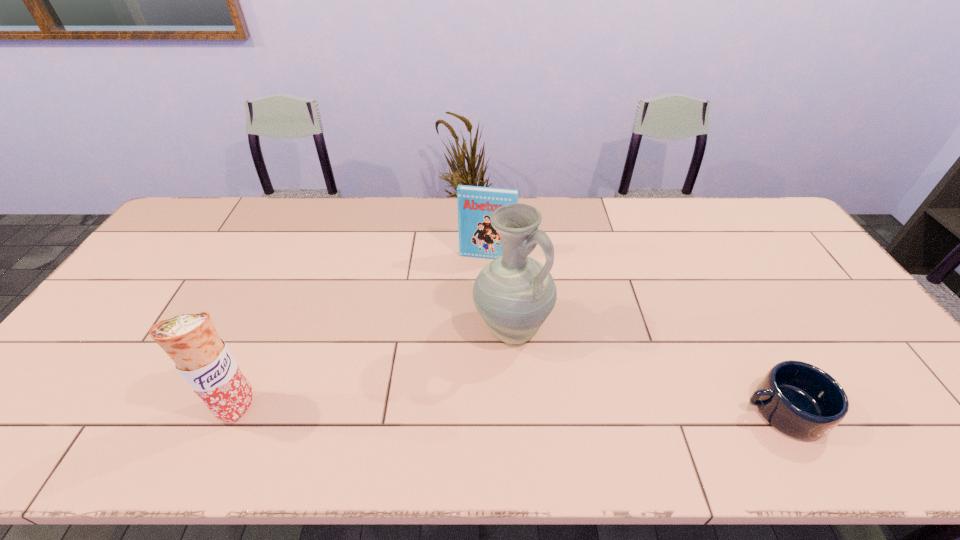
Identify the location of the third shortest object. (202, 358).

Where is `burrito`? This screenshot has width=960, height=540. burrito is located at coordinates (202, 358).

The width and height of the screenshot is (960, 540). Find the location of `mug`. mug is located at coordinates (800, 400).

Locate an element on the screen. The image size is (960, 540). the shortest object is located at coordinates (800, 400).

Locate an element on the screen. This screenshot has height=540, width=960. the second shortest object is located at coordinates (477, 238).

This screenshot has width=960, height=540. Find the location of `the farthest object`. the farthest object is located at coordinates (477, 238).

The image size is (960, 540). Identify the location of the tallest object. (514, 294).

Find the location of a particular element. the second farthest object is located at coordinates (514, 294).

Where is `free space located on the right of the burrito`? This screenshot has height=540, width=960. free space located on the right of the burrito is located at coordinates (344, 407).

Find the location of a particular element. blank space located 0.110m with the handle on the side of the shortest object is located at coordinates (695, 410).